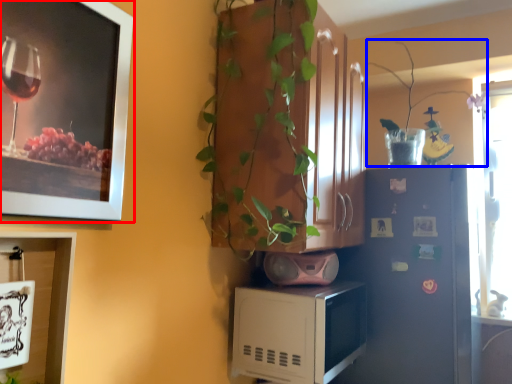
Question: Which object appears closest to the camera in this image, picture frame (highlighted by a red box) or plant (highlighted by a blue box)?

Choices:
 (A) picture frame
 (B) plant

Answer: (A)